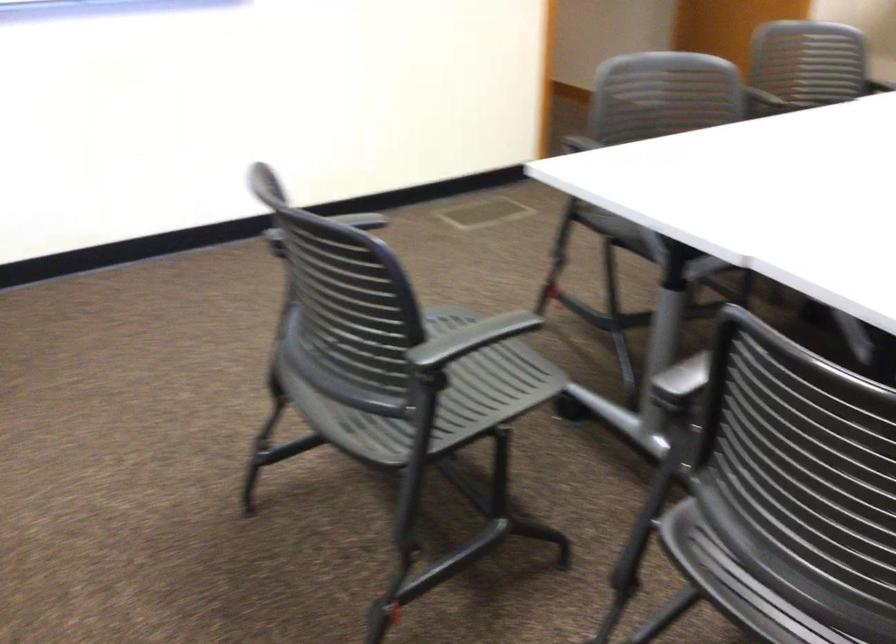
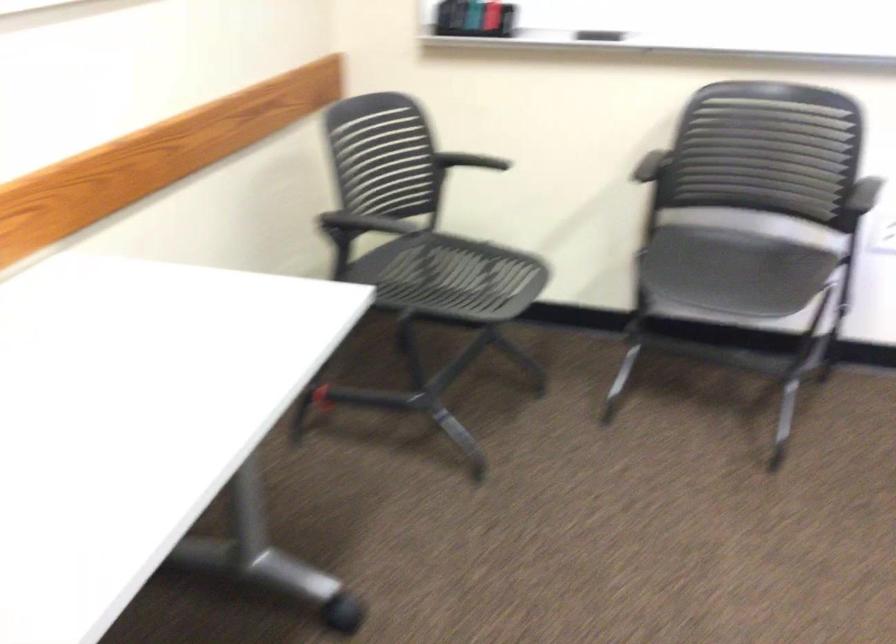
Question: The camera is either moving clockwise (left) or counter-clockwise (right) around the object. The first image is from the beginning of the video and the second image is from the end. Is the camera moving left or right when shooting the video?

Choices:
 (A) Left
 (B) Right

Answer: (B)